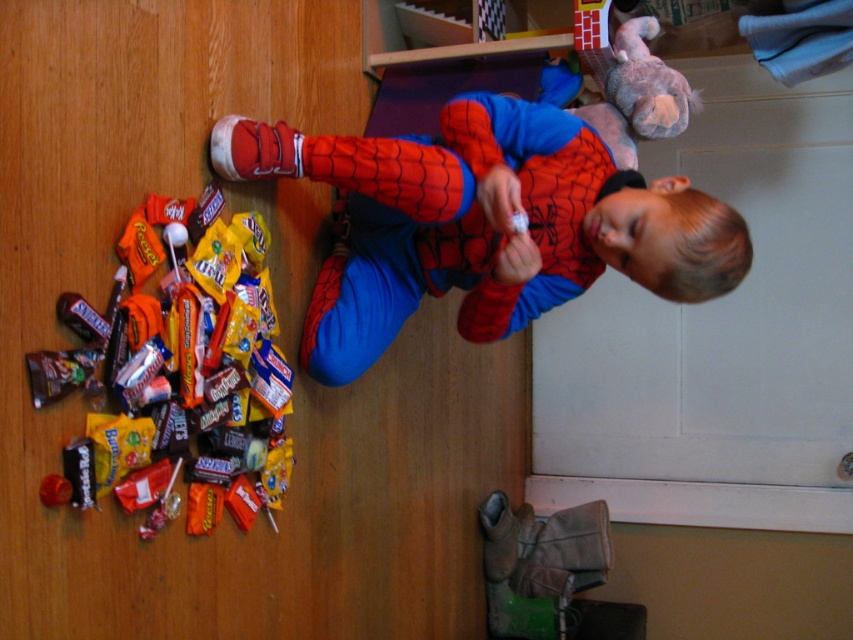
Is matte red costume at center further to camera compared to fluffy gray stuffed animal at upper right?

No.

Is matte red costume at center taller than fluffy gray stuffed animal at upper right?

Yes.

In the scene shown: Who is more forward, (508, 232) or (612, 90)?

Point (508, 232) is more forward.

The height and width of the screenshot is (640, 853). In order to click on matte red costume at center in this screenshot , I will do `click(482, 224)`.

Which of these two, shiny plastic candy at lower left or fluffy gray stuffed animal at upper right, stands shorter?

With less height is fluffy gray stuffed animal at upper right.

Between point (152, 300) and point (654, 138), which one is positioned behind?

The point (654, 138) is more distant.

Who is more distant from viewer, (x=45, y=483) or (x=676, y=104)?

The point (x=676, y=104) is behind.

Locate an element on the screen. shiny plastic candy at lower left is located at coordinates (187, 372).

This screenshot has width=853, height=640. What are the coordinates of `matte red costume at center` in the screenshot? It's located at (482, 224).

Does point (321, 157) lie in front of point (241, 234)?

That is False.

At what (x,y) coordinates should I click in order to perform the action: click on matte red costume at center. Please return your answer as a coordinate pair (x, y). The height and width of the screenshot is (640, 853). Looking at the image, I should click on coord(482,224).